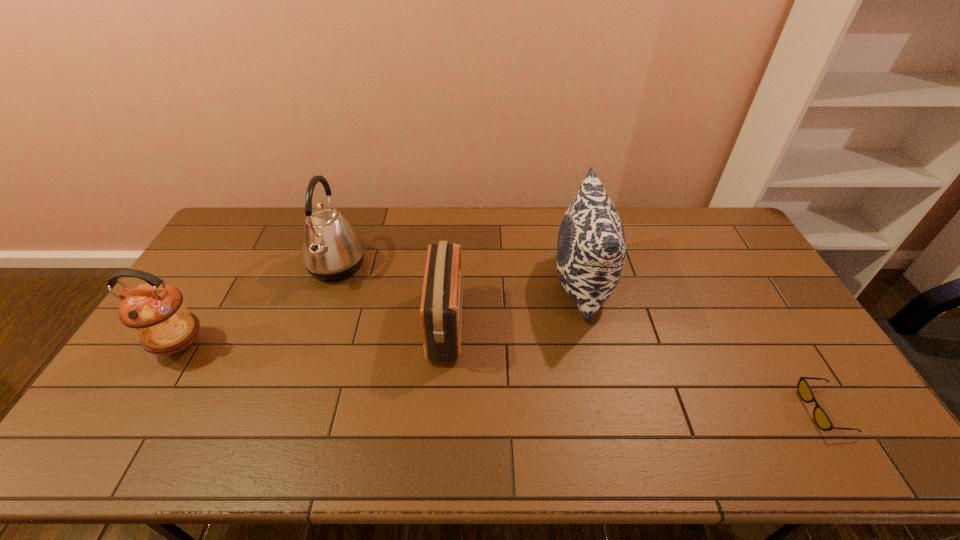
Where is `object present at the near right corner`? object present at the near right corner is located at coordinates (822, 420).

This screenshot has width=960, height=540. I want to click on free region at the far edge of the desktop, so click(x=486, y=207).

The width and height of the screenshot is (960, 540). I want to click on free space at the near edge of the desktop, so click(611, 438).

Image resolution: width=960 pixels, height=540 pixels. In order to click on free spot at the left edge of the desktop in this screenshot , I will do `click(204, 328)`.

I want to click on free space at the right edge of the desktop, so click(755, 269).

Identify the location of vacant space at the far left corner of the desktop. This screenshot has height=540, width=960. (275, 213).

I want to click on vacant space at the far right corner of the desktop, so click(x=716, y=233).

Identify the location of free space at the near right corner. The width and height of the screenshot is (960, 540). (846, 444).

At what (x,y) coordinates should I click in order to perform the action: click on vacant area between the oil lamp and the radio receiver. Please return your answer as a coordinate pair (x, y). Looking at the image, I should click on (313, 335).

Locate an element on the screen. This screenshot has height=540, width=960. free space between the nearest object and the fourth object from right to left is located at coordinates (580, 338).